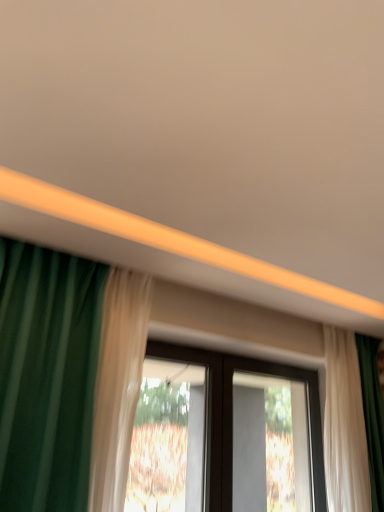
Question: Considering the positions of black plastic screen door at center and transparent glass window at center in the image, is black plastic screen door at center taller or shorter than transparent glass window at center?

Choices:
 (A) short
 (B) tall

Answer: (B)

Question: Is point (268, 498) positioned closer to the camera than point (177, 352)?

Choices:
 (A) closer
 (B) farther

Answer: (B)

Question: Which is farther from the white sheer curtain at right?

Choices:
 (A) black plastic screen door at center
 (B) transparent glass window at center

Answer: (A)

Question: Based on their relative distances, which object is farther from the black plastic screen door at center?

Choices:
 (A) white sheer curtain at right
 (B) transparent glass window at center

Answer: (A)